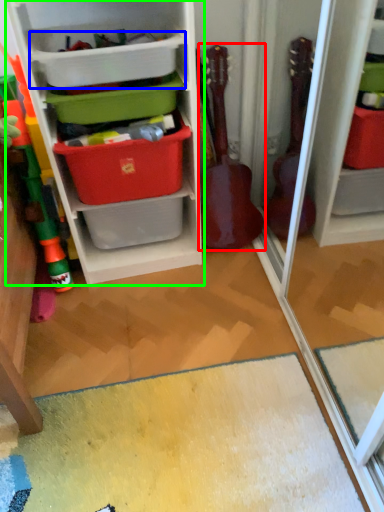
Question: Which object is positioned farthest from guitar (highlighted by a red box)? Select from storage box (highlighted by a blue box) and shelf (highlighted by a green box).

Choices:
 (A) storage box
 (B) shelf

Answer: (A)